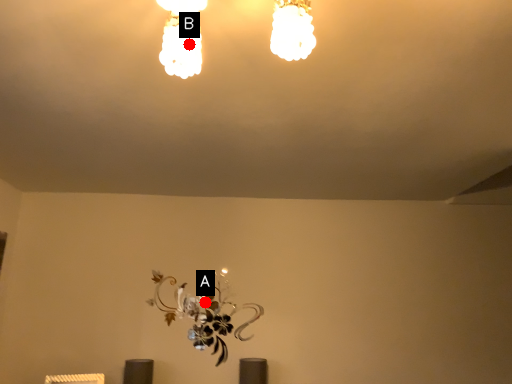
Question: Two points are circled on the image, labeled by A and B beside each circle. Among these points, which one is farthest from the camera?

Choices:
 (A) A is further
 (B) B is further

Answer: (A)